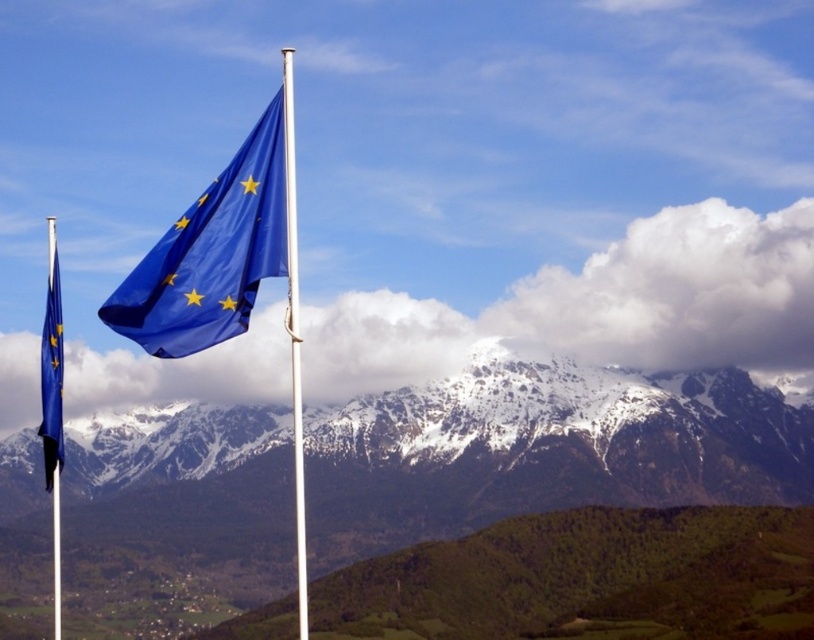
How distant is blue fabric flag at upper center from matte blue flag at left?

blue fabric flag at upper center is 86.27 meters from matte blue flag at left.

Between point (215, 326) and point (46, 417), which one is positioned in front?

Positioned in front is point (215, 326).

Which is behind, point (244, 198) or point (47, 272)?

Point (47, 272)

Locate an element on the screen. This screenshot has height=640, width=814. blue fabric flag at upper center is located at coordinates (211, 253).

Does white metallic flag pole at center appear under matte blue flag at left?

No, white metallic flag pole at center is not below matte blue flag at left.

Is point (300, 580) closer to viewer compared to point (51, 300)?

No.

Which is behind, point (292, 442) or point (55, 368)?

The point (292, 442) is behind.

Locate an element on the screen. white metallic flag pole at center is located at coordinates (294, 336).

Does blue fabric flag at upper center have a lesser width compared to white metallic flag pole at center?

In fact, blue fabric flag at upper center might be wider than white metallic flag pole at center.

Between blue fabric flag at upper center and white metallic flag pole at center, which one has less height?

blue fabric flag at upper center is shorter.

Between point (133, 273) and point (287, 145), which one is positioned in front?

Positioned in front is point (287, 145).

Locate an element on the screen. The height and width of the screenshot is (640, 814). blue fabric flag at upper center is located at coordinates (211, 253).